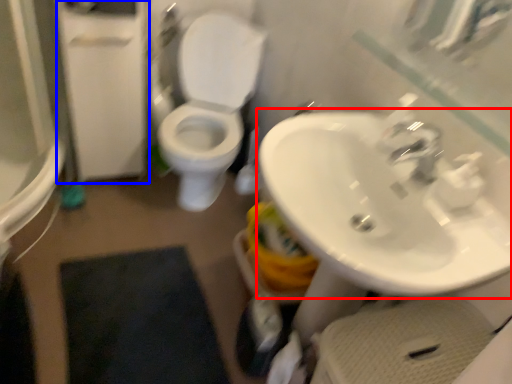
Question: Which object is closer to the camera taking this photo, sink (highlighted by a red box) or screen door (highlighted by a blue box)?

Choices:
 (A) sink
 (B) screen door

Answer: (A)